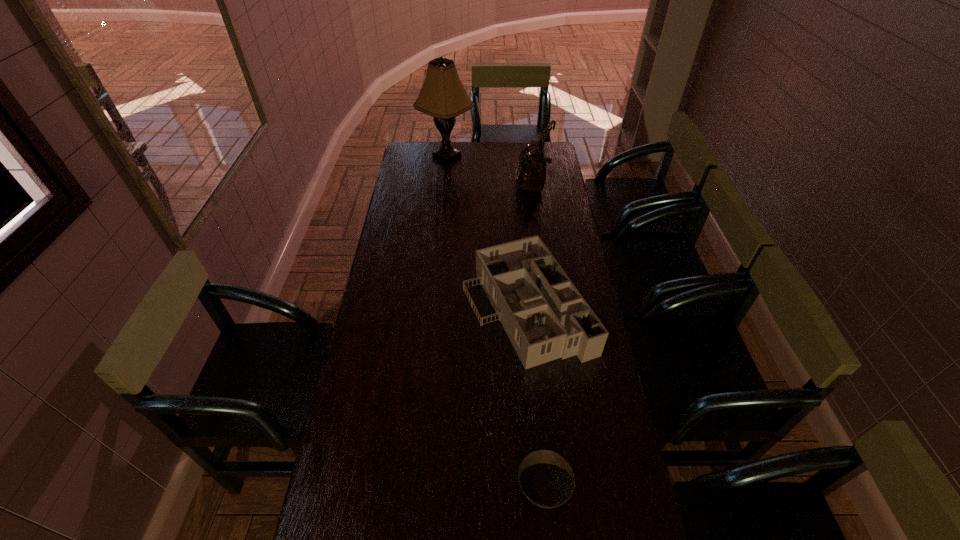
Identify which object is located as the third nearest to the second farthest object. Please provide its 2D coordinates. Your answer should be formatted as a tuple, i.e. [(x, y)], where the tuple contains the x and y coordinates of a point satisfying the conditions above.

[(547, 480)]

Locate which object ranks in proximity to the bowl. Please provide its 2D coordinates. Your answer should be formatted as a tuple, i.e. [(x, y)], where the tuple contains the x and y coordinates of a point satisfying the conditions above.

[(545, 317)]

Where is `vacant space that satisfies the following two spatial constraints: 1. on the back side of the bowl; 2. on the left side of the second shortest object`? vacant space that satisfies the following two spatial constraints: 1. on the back side of the bowl; 2. on the left side of the second shortest object is located at coordinates [x=526, y=308].

Where is `free location that satisfies the following two spatial constraints: 1. on the front side of the second shortest object; 2. on the right side of the tallest object`? The height and width of the screenshot is (540, 960). free location that satisfies the following two spatial constraints: 1. on the front side of the second shortest object; 2. on the right side of the tallest object is located at coordinates (432, 308).

Locate an element on the screen. The width and height of the screenshot is (960, 540). free space that satisfies the following two spatial constraints: 1. on the front-facing side of the shoulder bag; 2. on the front side of the bowl is located at coordinates (577, 489).